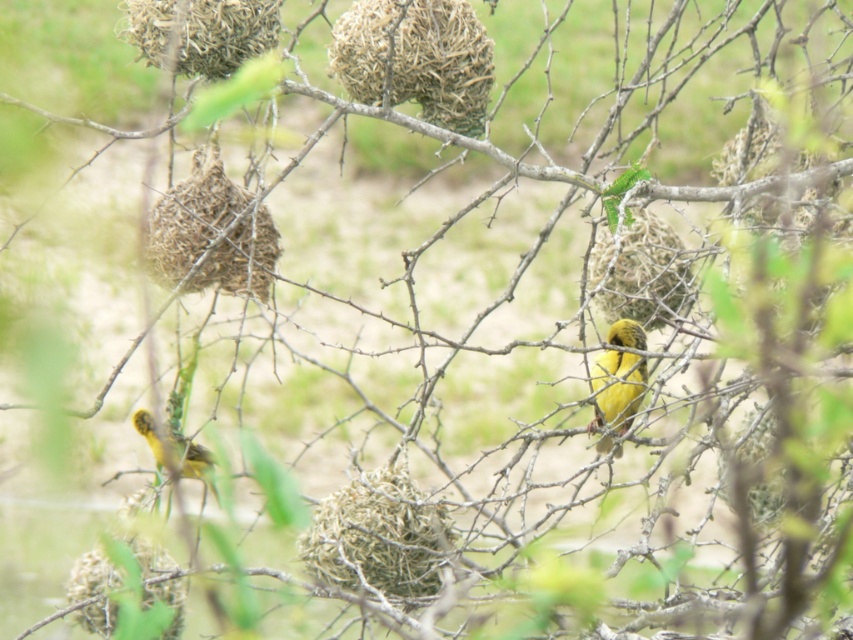
Question: Is yellow matte bird at center smaller than yellow matte bird at left?

Choices:
 (A) no
 (B) yes

Answer: (B)

Question: Can you confirm if green textured nest at center is positioned to the right of yellow matte bird at left?

Choices:
 (A) yes
 (B) no

Answer: (A)

Question: Which of these objects is positioned closest to the yellow matte bird at center?

Choices:
 (A) yellow matte bird at left
 (B) brown textured nest at upper center
 (C) brown woven nest at upper left

Answer: (B)

Question: Is brown textured nest at upper center below yellow matte bird at center?

Choices:
 (A) no
 (B) yes

Answer: (A)

Question: Which point is farther from the camera taking this photo?

Choices:
 (A) (195, 227)
 (B) (606, 442)

Answer: (B)

Question: Which point appears closest to the camera in this image?

Choices:
 (A) (637, 372)
 (B) (189, 449)
 (C) (250, 278)

Answer: (C)